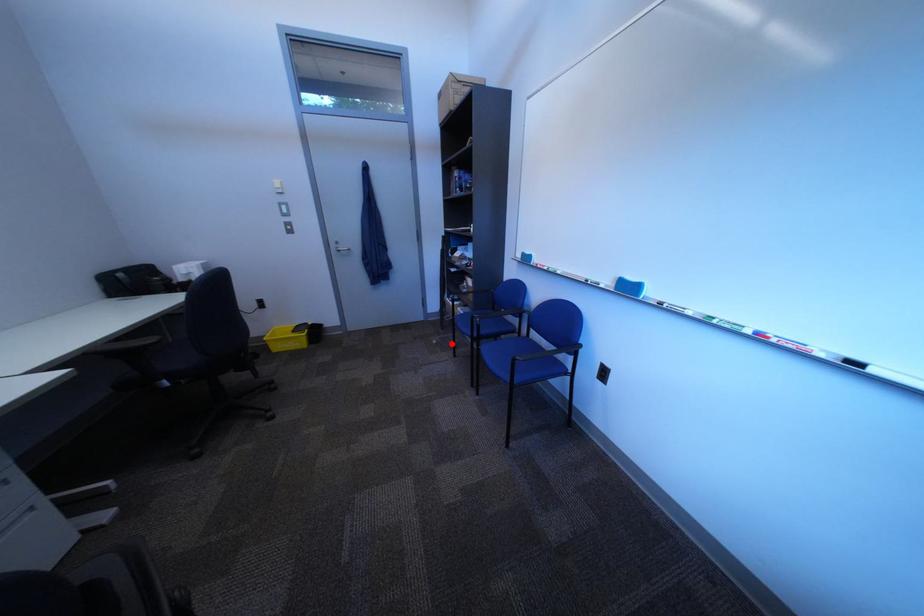
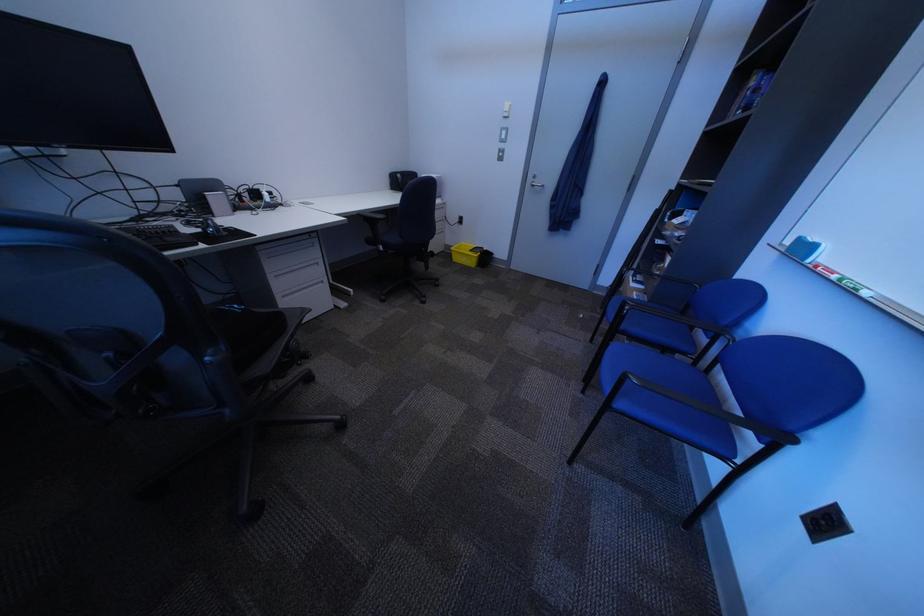
Question: I am providing you with two images of the same scene from different viewpoints. Image1 has a red point marked. In image2, the corresponding 3D location appears at what relative position? Reply with the corresponding letter.

Choices:
 (A) Closer
 (B) Farther

Answer: (A)